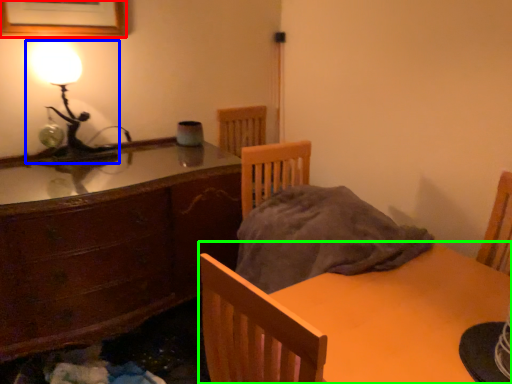
Question: Which object is positioned closest to picture frame (highlighted by a red box)? Select from lamp (highlighted by a blue box) and table (highlighted by a green box).

Choices:
 (A) lamp
 (B) table

Answer: (A)